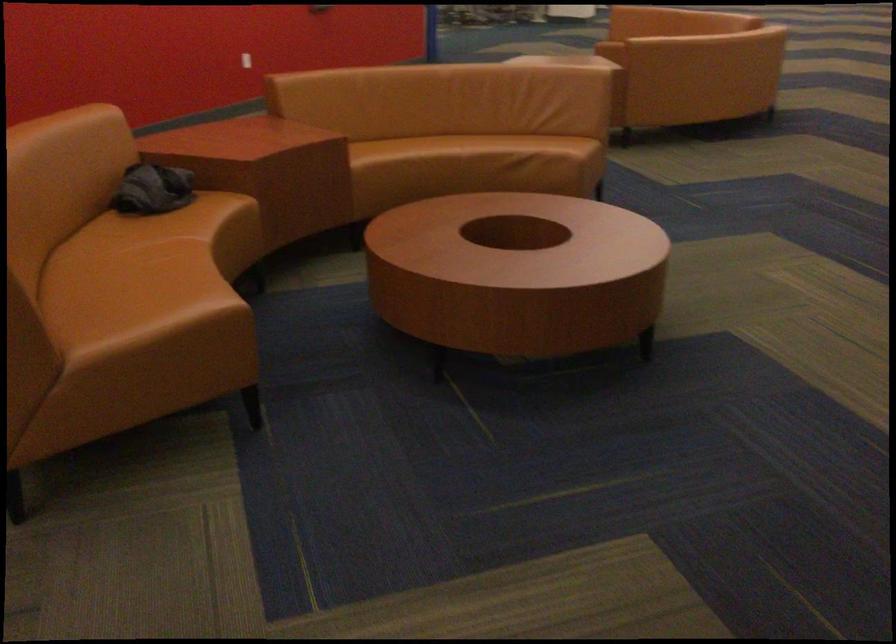
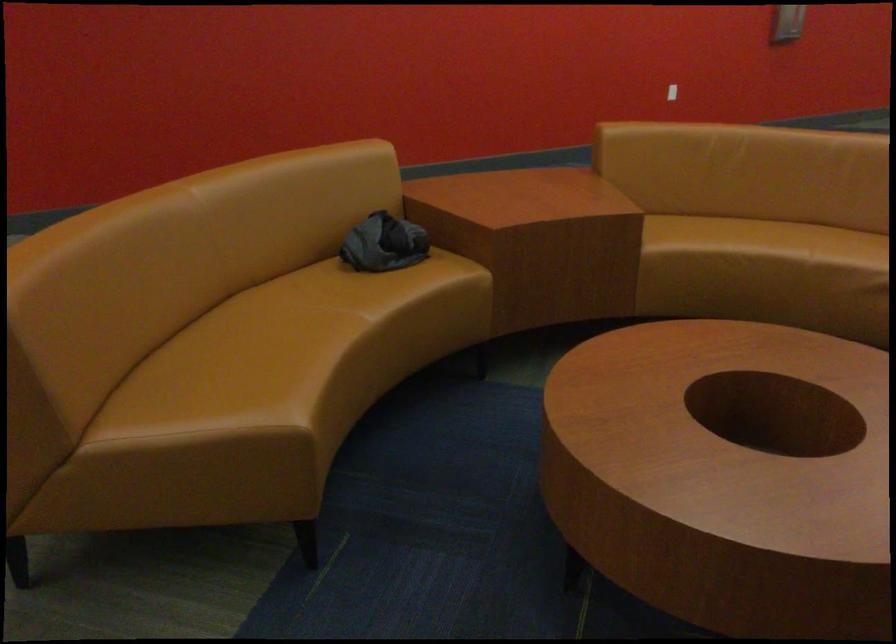
Where in the second image is the point corresponding to pixel 162 191 from the first image?

(383, 243)